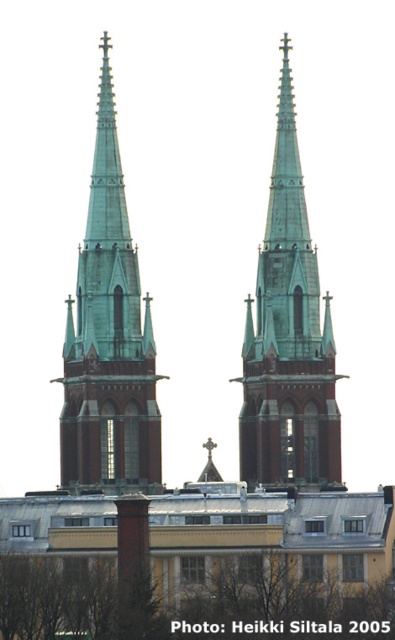
You are standing in front of a cathedral and notice the green copper steeple at center and the brown leafy tree at lower center. Which object appears narrower when viewed from your current position?

The green copper steeple at center appears narrower than the brown leafy tree at lower center.

You are standing in front of a cathedral with two green copper structures. You notice the green copper spire at center and the green copper steeple at center. Which one is closer to you?

The green copper spire at center is closer to you because it is in front of the green copper steeple at center.